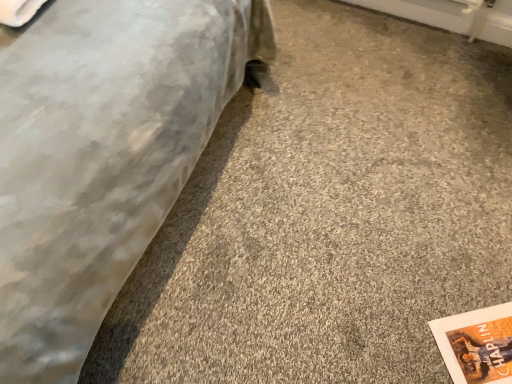
Find the location of a particular element. This screenshot has height=384, width=512. vacant region below orange paper book at lower right (from a real-world perspective) is located at coordinates (478, 345).